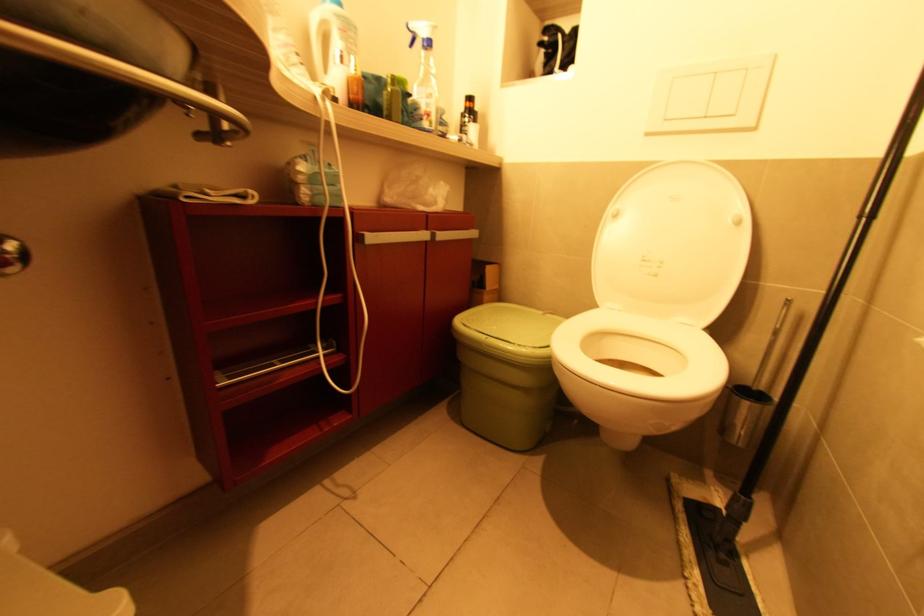
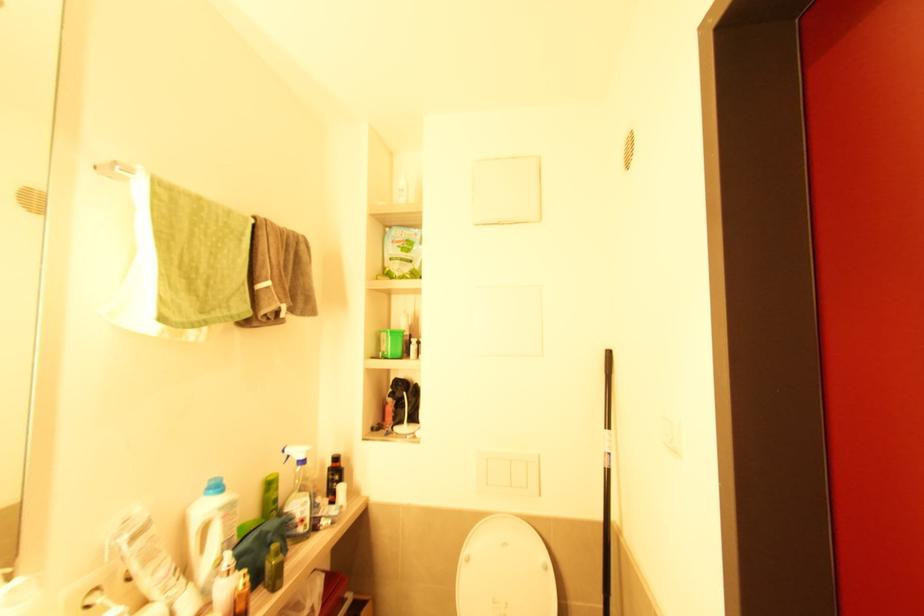
In the second image, find the point that corresponds to the point at 342,31 in the first image.

(224, 519)